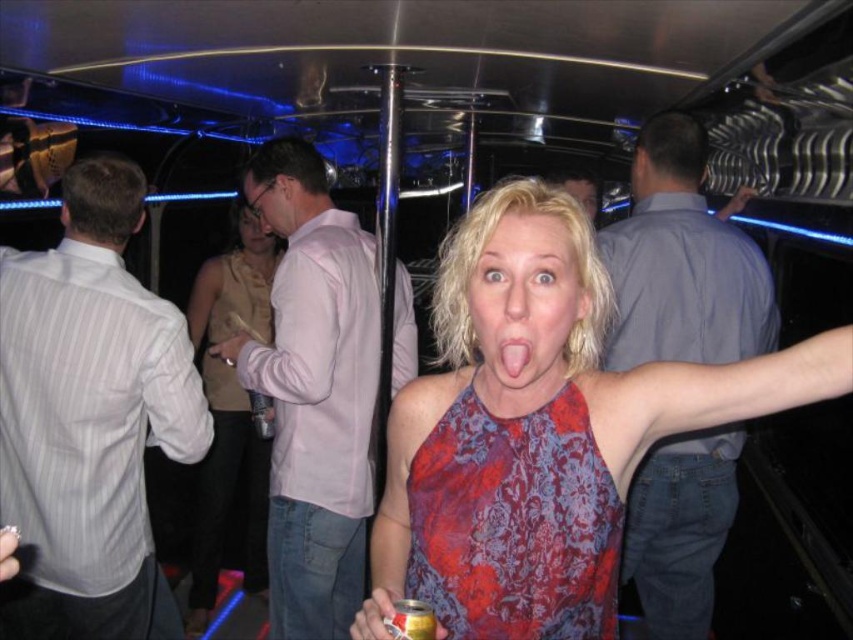
Question: Based on their relative distances, which object is farther from the blonde hair at center?

Choices:
 (A) matte beige face at center
 (B) denim jeans at right

Answer: (A)

Question: Which of these objects is positioned closest to the floral silk dress at center?

Choices:
 (A) light pink cotton shirt at center
 (B) blonde hair at center
 (C) matte floral dress at center

Answer: (C)

Question: Which of the following is the farthest from the observer?

Choices:
 (A) (267, 241)
 (B) (479, 544)
 (C) (73, 316)

Answer: (A)

Question: Can you confirm if white striped shirt at left is positioned to the right of matte beige dress at center?

Choices:
 (A) yes
 (B) no

Answer: (B)

Question: Observing the image, what is the correct spatial positioning of matte floral dress at center in reference to matte pink shirt at center?

Choices:
 (A) below
 (B) above

Answer: (A)

Question: Does denim jeans at right lie in front of blonde hair at center?

Choices:
 (A) yes
 (B) no

Answer: (A)